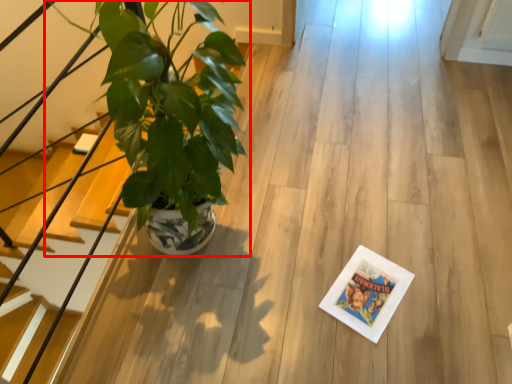
Question: From the image's perspective, where is houseplant (annotated by the red box) located relative to stairs?

Choices:
 (A) below
 (B) above

Answer: (B)